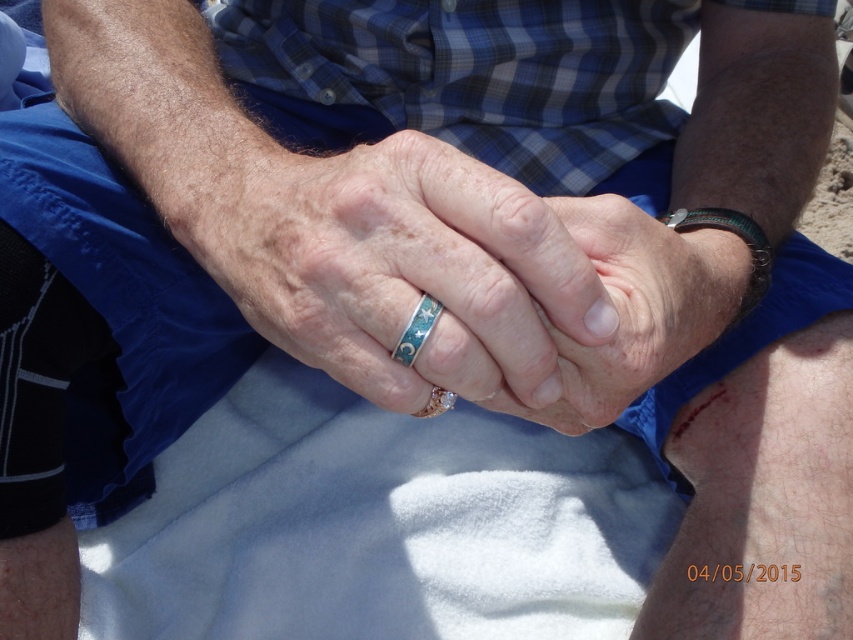
You are a photographer trying to capture a closeup of the hands in the scene. You notice two specific points marked as point 1 at coordinates point (616,314) and point 2 at coordinates point (740,230). Which point should you focus on to ensure the closest part of the hands is in sharp focus?

Point (616,314) is closer to the camera than point (740,230), so you should focus on point (616,314) to ensure the closest part of the hands is in sharp focus.

You are a photographer trying to capture a closeup of the hands on the towel. You want to ensure the focus is sharp on the ring with stars and crescent moons. Given that the camera is focused at the point specified, will the ring be in focus if it is located at point (601, 419)?

The distance between the camera and point (601, 419) is 15.54 inches. Since the camera is focused at that point, the ring with stars and crescent moons located there will be in focus.

You are a photographer at a beach scene. You need to capture a close shot of the turquoise glossy ring at center and the green leather bracelet at upper right. Which object should you focus on first if you want to ensure both are in frame without moving the camera?

The turquoise glossy ring at center is to the left of the green leather bracelet at upper right. Since the ring is positioned to the left, you should focus on the turquoise glossy ring at center first to ensure both objects remain in frame without moving the camera.